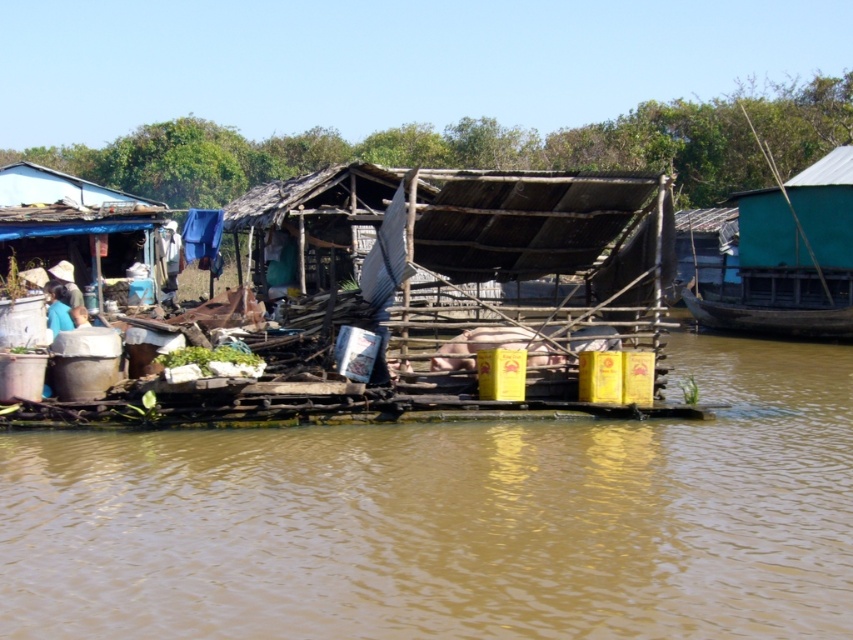
You are a visitor standing on the green corrugated metal boat at right and want to step onto the brown muddy water at center. Is this possible?

The brown muddy water at center is shorter than the green corrugated metal boat at right, so stepping onto the brown muddy water at center from the green corrugated metal boat at right is not possible because the water level is lower than the boat.

You are a visitor to this riverside village and want to know which area takes up more space in the scene. Which object between the brown muddy water at center and the green corrugated metal boat at right covers a larger area?

The green corrugated metal boat at right covers a larger area than the brown muddy water at center because the brown muddy water at center occupies less space than the green corrugated metal boat at right.